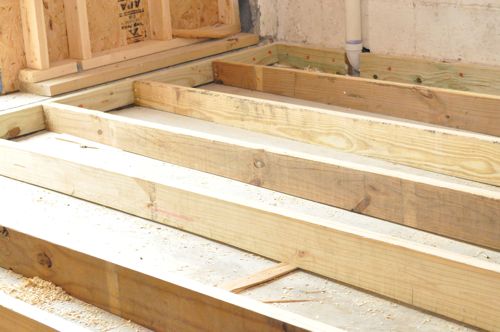
I want to click on white wall, so click(442, 32).